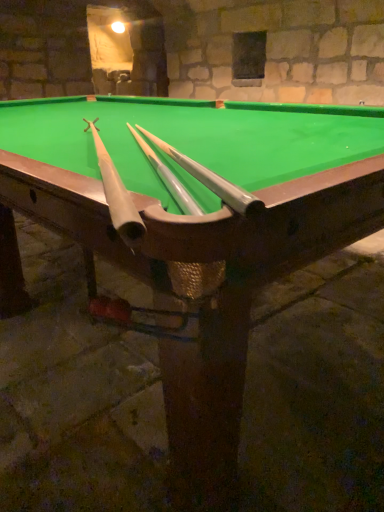
This screenshot has height=512, width=384. In order to click on matte white cue at center, the second cue viewed from the right in this screenshot , I will do `click(117, 196)`.

In order to face matte white cue at center, the second cue viewed from the right, should I rotate leftwards or rightwards?

Turn left by 12.298 degrees to look at matte white cue at center, the second cue viewed from the right.

The height and width of the screenshot is (512, 384). What do you see at coordinates (117, 196) in the screenshot?
I see `matte white cue at center, the second cue viewed from the right` at bounding box center [117, 196].

What is the approximate width of silver metallic cue at center, which is the 1th cue from right to left?

It is 4.80 feet.

The image size is (384, 512). What do you see at coordinates (210, 179) in the screenshot?
I see `silver metallic cue at center, which is the 1th cue from right to left` at bounding box center [210, 179].

Where is `silver metallic cue at center, which is counted as the second cue, starting from the left`? This screenshot has height=512, width=384. silver metallic cue at center, which is counted as the second cue, starting from the left is located at coordinates (210, 179).

Identify the location of matte white cue at center, which is counted as the first cue, starting from the left. The width and height of the screenshot is (384, 512). (117, 196).

Considering the positions of objects silver metallic cue at center, which is counted as the second cue, starting from the left, and matte white cue at center, the second cue viewed from the right, in the image provided, who is more to the left, silver metallic cue at center, which is counted as the second cue, starting from the left, or matte white cue at center, the second cue viewed from the right,?

From the viewer's perspective, matte white cue at center, the second cue viewed from the right, appears more on the left side.

Based on the photo, considering their positions, is silver metallic cue at center, which is counted as the second cue, starting from the left, located in front of or behind matte white cue at center, which is counted as the first cue, starting from the left?

Clearly, silver metallic cue at center, which is counted as the second cue, starting from the left, is behind matte white cue at center, which is counted as the first cue, starting from the left.

Considering the positions of point (207, 183) and point (93, 125), is point (207, 183) closer or farther from the camera than point (93, 125)?

Point (207, 183) is positioned closer to the camera compared to point (93, 125).

From the image's perspective, does silver metallic cue at center, which is the 1th cue from right to left, appear higher than matte white cue at center, which is counted as the first cue, starting from the left?

Correct, silver metallic cue at center, which is the 1th cue from right to left, appears higher than matte white cue at center, which is counted as the first cue, starting from the left, in the image.

From a real-world perspective, is silver metallic cue at center, which is the 1th cue from right to left, above or below matte white cue at center, which is counted as the first cue, starting from the left?

silver metallic cue at center, which is the 1th cue from right to left, is situated lower than matte white cue at center, which is counted as the first cue, starting from the left, in the real world.

Does silver metallic cue at center, which is the 1th cue from right to left, have a greater width compared to matte white cue at center, the second cue viewed from the right?

Incorrect, the width of silver metallic cue at center, which is the 1th cue from right to left, does not surpass that of matte white cue at center, the second cue viewed from the right.

Does silver metallic cue at center, which is counted as the second cue, starting from the left, have a greater height compared to matte white cue at center, the second cue viewed from the right?

In fact, silver metallic cue at center, which is counted as the second cue, starting from the left, may be shorter than matte white cue at center, the second cue viewed from the right.

Which of these two, silver metallic cue at center, which is the 1th cue from right to left, or matte white cue at center, the second cue viewed from the right, is bigger?

Bigger between the two is matte white cue at center, the second cue viewed from the right.

Choose the correct answer: Is silver metallic cue at center, which is counted as the second cue, starting from the left, inside matte white cue at center, the second cue viewed from the right, or outside it?

silver metallic cue at center, which is counted as the second cue, starting from the left, is not enclosed by matte white cue at center, the second cue viewed from the right.

Is silver metallic cue at center, which is counted as the second cue, starting from the left, positioned far away from matte white cue at center, the second cue viewed from the right?

No, silver metallic cue at center, which is counted as the second cue, starting from the left, is not far away from matte white cue at center, the second cue viewed from the right.

Could you tell me if silver metallic cue at center, which is the 1th cue from right to left, is turned towards matte white cue at center, the second cue viewed from the right?

No, silver metallic cue at center, which is the 1th cue from right to left, is not turned towards matte white cue at center, the second cue viewed from the right.

How different are the orientations of silver metallic cue at center, which is counted as the second cue, starting from the left, and matte white cue at center, which is counted as the first cue, starting from the left, in degrees?

The angular difference between silver metallic cue at center, which is counted as the second cue, starting from the left, and matte white cue at center, which is counted as the first cue, starting from the left, is 2.21 degrees.

This screenshot has height=512, width=384. What are the coordinates of `cue located on the right of matte white cue at center, which is counted as the first cue, starting from the left` in the screenshot? It's located at (210, 179).

Does matte white cue at center, which is counted as the first cue, starting from the left, appear on the left side of silver metallic cue at center, which is the 1th cue from right to left?

Correct, you'll find matte white cue at center, which is counted as the first cue, starting from the left, to the left of silver metallic cue at center, which is the 1th cue from right to left.

In the image, is matte white cue at center, the second cue viewed from the right, positioned in front of or behind silver metallic cue at center, which is the 1th cue from right to left?

Visually, matte white cue at center, the second cue viewed from the right, is located in front of silver metallic cue at center, which is the 1th cue from right to left.

Considering the positions of points (116, 212) and (192, 167), is point (116, 212) farther from camera compared to point (192, 167)?

No.

From the image's perspective, between matte white cue at center, which is counted as the first cue, starting from the left, and silver metallic cue at center, which is counted as the second cue, starting from the left, who is located below?

matte white cue at center, which is counted as the first cue, starting from the left, is shown below in the image.

From a real-world perspective, which object rests below the other?

→ From a 3D spatial view, silver metallic cue at center, which is the 1th cue from right to left, is below.

Is matte white cue at center, which is counted as the first cue, starting from the left, wider or thinner than silver metallic cue at center, which is the 1th cue from right to left?

Clearly, matte white cue at center, which is counted as the first cue, starting from the left, has more width compared to silver metallic cue at center, which is the 1th cue from right to left.

Can you confirm if matte white cue at center, which is counted as the first cue, starting from the left, is taller than silver metallic cue at center, which is the 1th cue from right to left?

Indeed, matte white cue at center, which is counted as the first cue, starting from the left, has a greater height compared to silver metallic cue at center, which is the 1th cue from right to left.

Does matte white cue at center, the second cue viewed from the right, have a smaller size compared to silver metallic cue at center, which is the 1th cue from right to left?

No.

Choose the correct answer: Is matte white cue at center, which is counted as the first cue, starting from the left, inside silver metallic cue at center, which is the 1th cue from right to left, or outside it?

matte white cue at center, which is counted as the first cue, starting from the left, exists outside the volume of silver metallic cue at center, which is the 1th cue from right to left.

Is matte white cue at center, the second cue viewed from the right, directly adjacent to silver metallic cue at center, which is the 1th cue from right to left?

No, matte white cue at center, the second cue viewed from the right, is not next to silver metallic cue at center, which is the 1th cue from right to left.

Is matte white cue at center, which is counted as the first cue, starting from the left, aimed at silver metallic cue at center, which is the 1th cue from right to left?

No, matte white cue at center, which is counted as the first cue, starting from the left, is not aimed at silver metallic cue at center, which is the 1th cue from right to left.

This screenshot has width=384, height=512. Find the location of `cue on the right of the matte white cue at center, which is counted as the first cue, starting from the left`. cue on the right of the matte white cue at center, which is counted as the first cue, starting from the left is located at coordinates (210, 179).

What are the coordinates of `cue beneath the matte white cue at center, which is counted as the first cue, starting from the left (from a real-world perspective)` in the screenshot? It's located at (210, 179).

In order to click on cue located in front of the silver metallic cue at center, which is the 1th cue from right to left in this screenshot , I will do `click(117, 196)`.